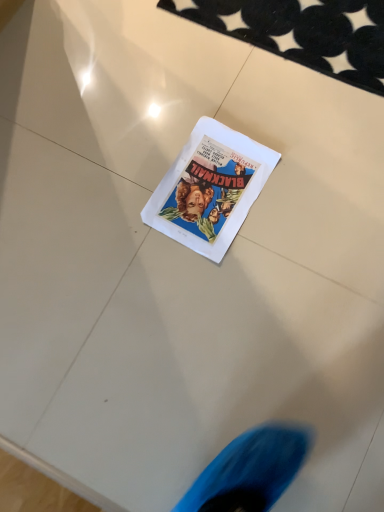
What do you see at coordinates (210, 188) in the screenshot?
I see `white paper flyer at center` at bounding box center [210, 188].

What is the approximate width of white paper flyer at center?

It is 12.19 inches.

At what (x,y) coordinates should I click in order to perform the action: click on white paper flyer at center. Please return your answer as a coordinate pair (x, y). The height and width of the screenshot is (512, 384). Looking at the image, I should click on (210, 188).

Identify the location of white paper flyer at center. Image resolution: width=384 pixels, height=512 pixels. (210, 188).